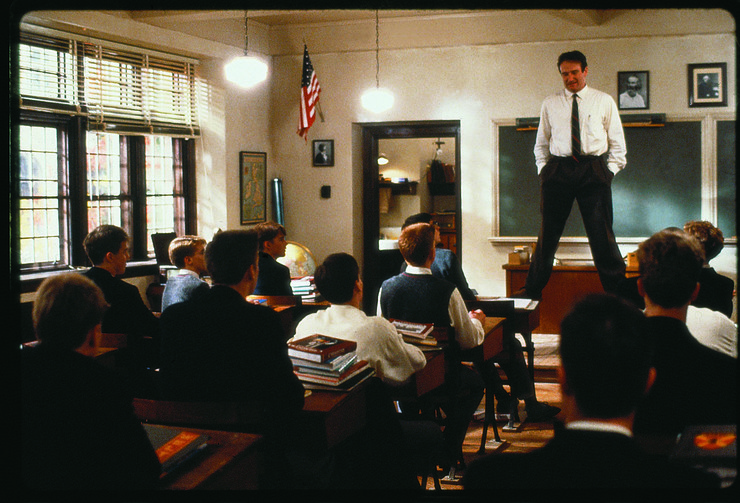
The image size is (740, 503). Find the location of `stack of books on desk`. stack of books on desk is located at coordinates click(x=325, y=362).